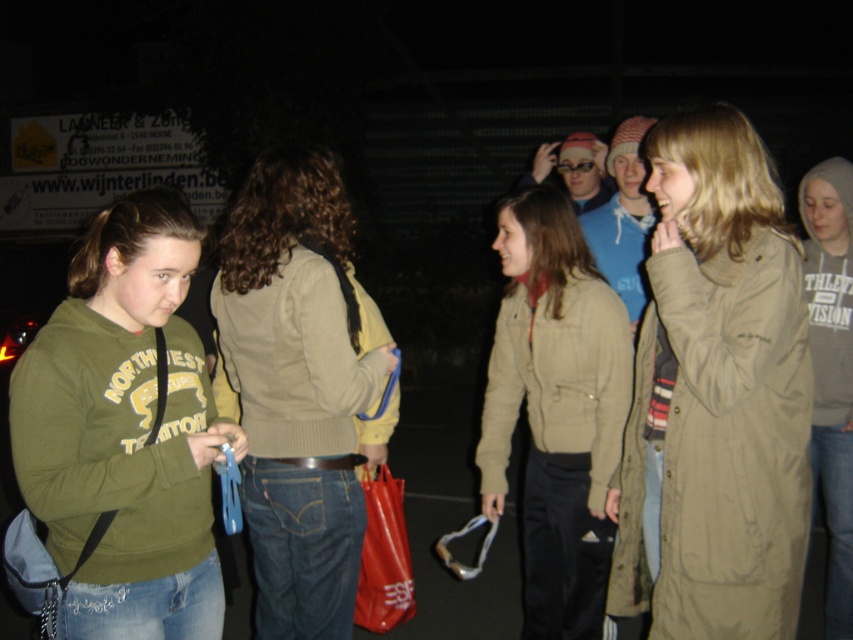
Question: Observing the image, what is the correct spatial positioning of olive green hoodie at left in reference to beige sweater at center?

Choices:
 (A) right
 (B) left

Answer: (B)

Question: Does olive green hoodie at left have a smaller size compared to beige knitted sweater at center?

Choices:
 (A) no
 (B) yes

Answer: (B)

Question: Which of the following is the farthest from the observer?

Choices:
 (A) (163, 458)
 (B) (329, 289)
 (C) (527, 525)

Answer: (C)

Question: Which point appears farthest from the camera in this image?

Choices:
 (A) (335, 166)
 (B) (196, 461)
 (C) (303, 256)

Answer: (A)

Question: Is olive green hoodie at left closer to camera compared to beige knitted sweater at center?

Choices:
 (A) yes
 (B) no

Answer: (A)

Question: Which point is farther to the camera?

Choices:
 (A) matte khaki jacket at center
 (B) beige knitted sweater at center
 (C) olive green hoodie at left
 (D) beige sweater at center

Answer: (A)